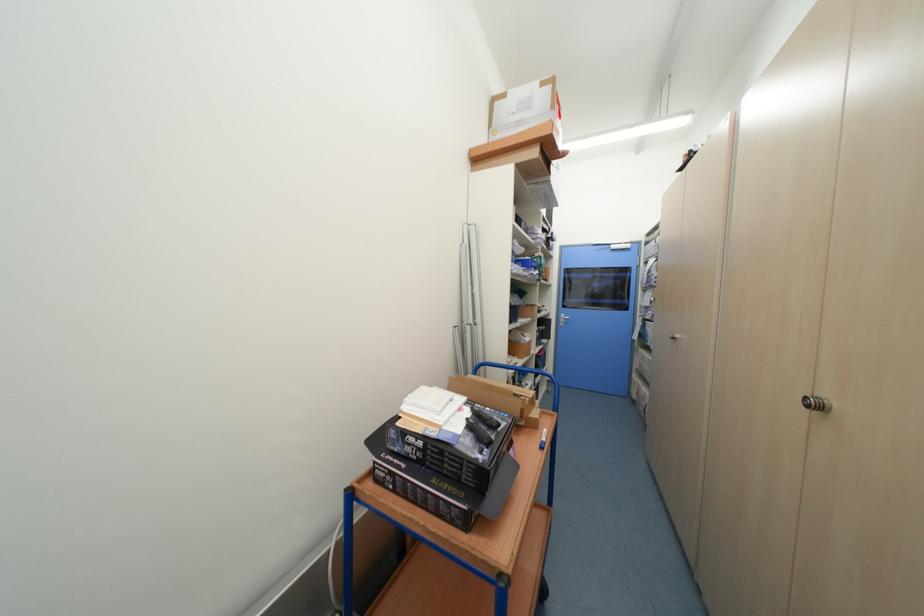
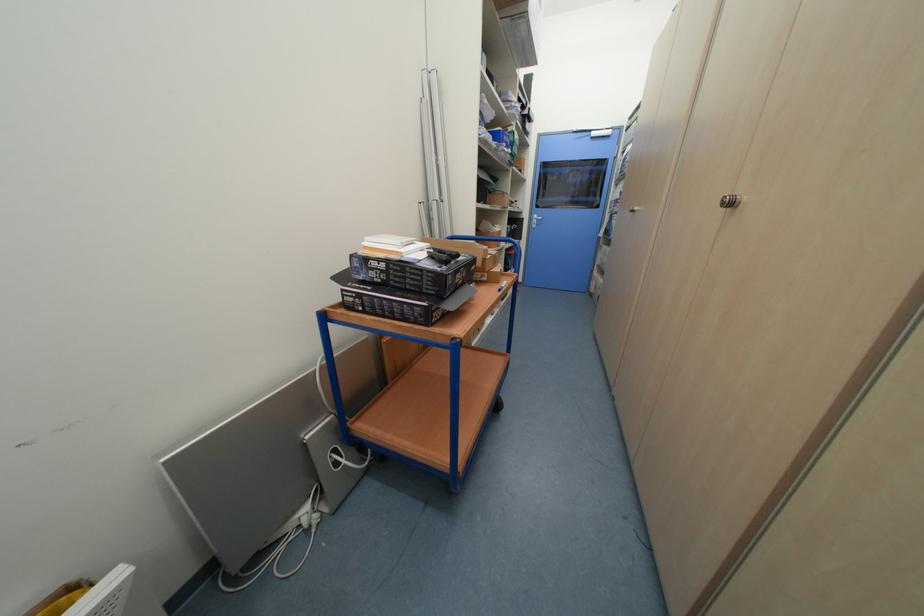
Question: Based on the continuous images, in which direction is the camera rotating? Reply with the corresponding letter.

Choices:
 (A) Left
 (B) Right
 (C) Up
 (D) Down

Answer: (D)